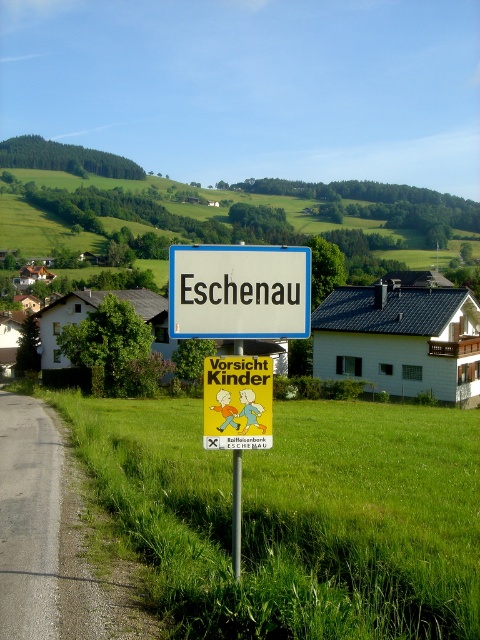
Question: Is green grass at lower center to the right of white plastic sign at center from the viewer's perspective?

Choices:
 (A) no
 (B) yes

Answer: (B)

Question: Can you confirm if green grass at lower center is thinner than metallic pole at center?

Choices:
 (A) no
 (B) yes

Answer: (A)

Question: Among these points, which one is nearest to the camera?

Choices:
 (A) (371, 552)
 (B) (252, 394)
 (C) (236, 474)
 (D) (172, 266)

Answer: (C)

Question: Which point is farther to the camera?

Choices:
 (A) metallic pole at center
 (B) yellow paper sign at center
 (C) green grass at lower center
 (D) white plastic sign at center

Answer: (D)

Question: Which object is farther from the camera taking this photo?

Choices:
 (A) metallic pole at center
 (B) green grass at lower center
 (C) white plastic sign at center

Answer: (C)

Question: Is white plastic sign at center below metallic pole at center?

Choices:
 (A) no
 (B) yes

Answer: (A)